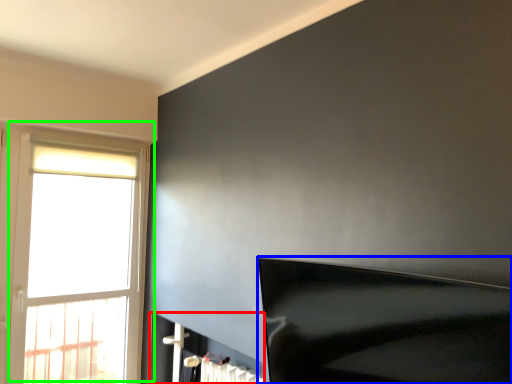
Question: Which is nearer to the fireplace (highlighted by a red box)? furniture (highlighted by a blue box) or window (highlighted by a green box).

Choices:
 (A) furniture
 (B) window

Answer: (B)